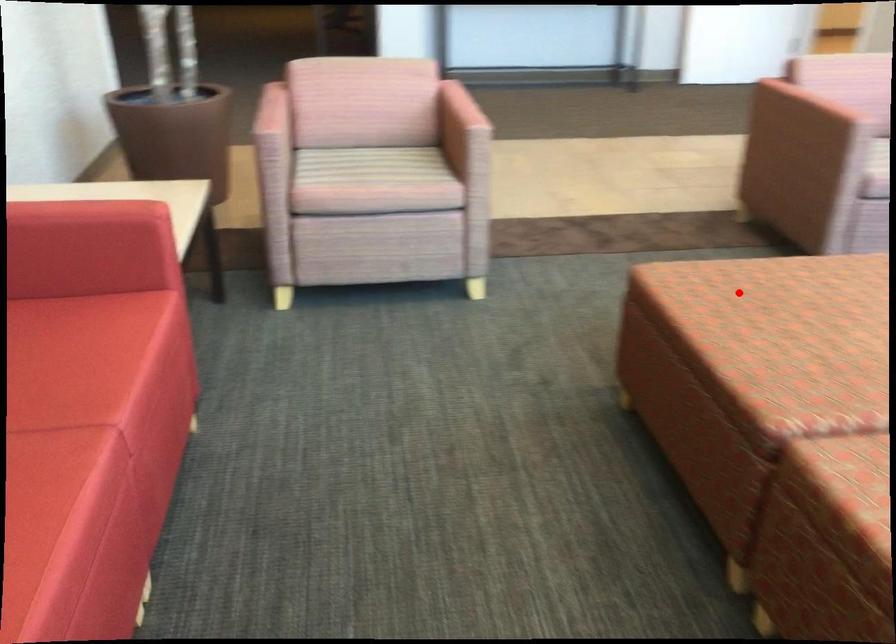
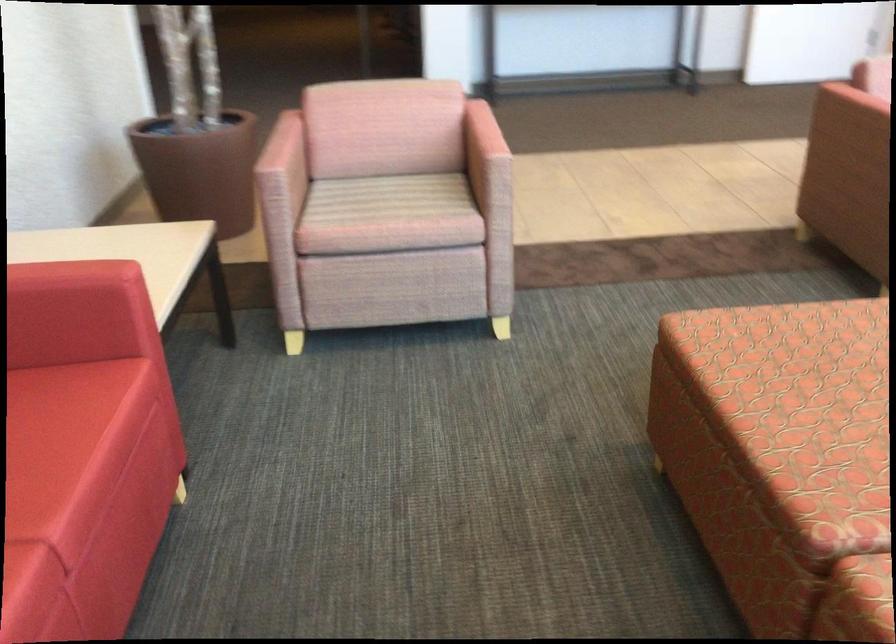
Question: I am providing you with two images of the same scene from different viewpoints. Given a red point in image1, look at the same physical point in image2. Is it:

Choices:
 (A) Closer to the viewpoint
 (B) Farther from the viewpoint

Answer: (A)